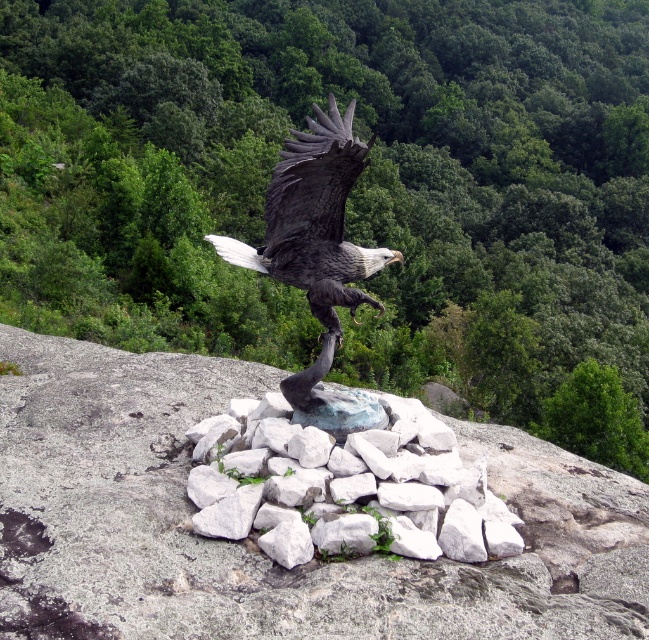
You are an artist planning to create a miniature version of the sculpture. You want to ensure the proportions between the white stone at center and the shiny black eagle at center remain accurate. Based on the original sculpture, which object should be scaled down more when creating the miniature?

The white stone at center has a smaller size compared to the shiny black eagle at center in the original sculpture. Therefore, when creating the miniature, the white stone at center should be scaled down more to maintain the proportional relationship between the two objects.

You are standing in front of the sculpture of the bald eagle. There is a point marked at coordinates (349, 486). What does this point indicate?

The point at (349, 486) marks the location of the white stone at center in the sculpture.